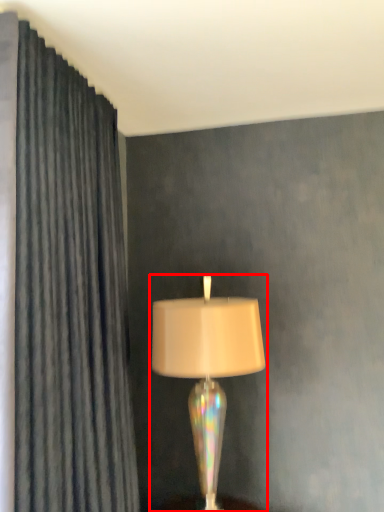
Question: In this image, where is lamp (annotated by the red box) located relative to curtain?

Choices:
 (A) left
 (B) right

Answer: (B)